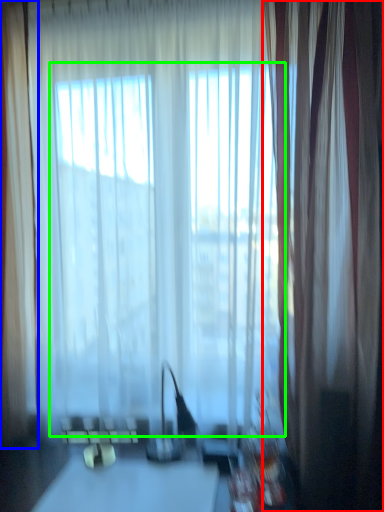
Question: Which object is positioned closest to curtain (highlighted by a red box)? Select from curtain (highlighted by a blue box) and bay window (highlighted by a green box).

Choices:
 (A) curtain
 (B) bay window

Answer: (B)